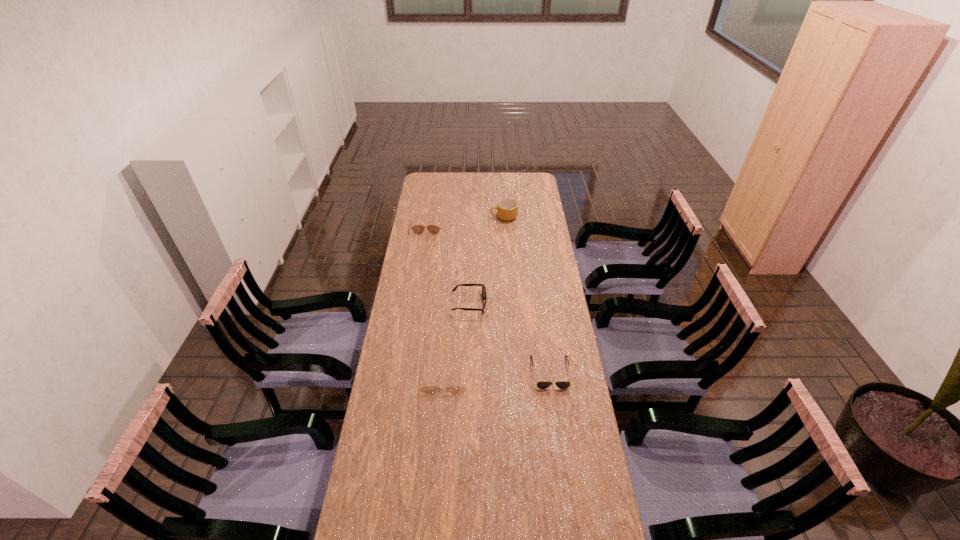
I want to click on the tallest object, so click(507, 209).

This screenshot has height=540, width=960. Find the location of `the farthest sunglasses`. the farthest sunglasses is located at coordinates (417, 229).

At what (x,y) coordinates should I click in order to perform the action: click on the third nearest object. Please return your answer as a coordinate pair (x, y). This screenshot has width=960, height=540. Looking at the image, I should click on (484, 296).

At what (x,y) coordinates should I click in order to perform the action: click on the rightmost sunglasses. Please return your answer as a coordinate pair (x, y). Looking at the image, I should click on (541, 384).

Where is `vacant area located 0.370m on the side with the handle of the tallest object`? The image size is (960, 540). vacant area located 0.370m on the side with the handle of the tallest object is located at coordinates (422, 217).

Find the location of a particular element. The height and width of the screenshot is (540, 960). free point located on the side with the handle of the tallest object is located at coordinates (448, 217).

I want to click on vacant space located 0.050m on the side with the handle of the tallest object, so click(x=481, y=217).

The width and height of the screenshot is (960, 540). In order to click on vacant space located on the front-facing side of the farthest sunglasses in this screenshot , I will do `click(420, 274)`.

Locate an element on the screen. The image size is (960, 540). free space located on the front-facing side of the third farthest object is located at coordinates (537, 305).

What are the coordinates of `vacant space located on the front-facing side of the rightmost sunglasses` in the screenshot? It's located at tap(561, 444).